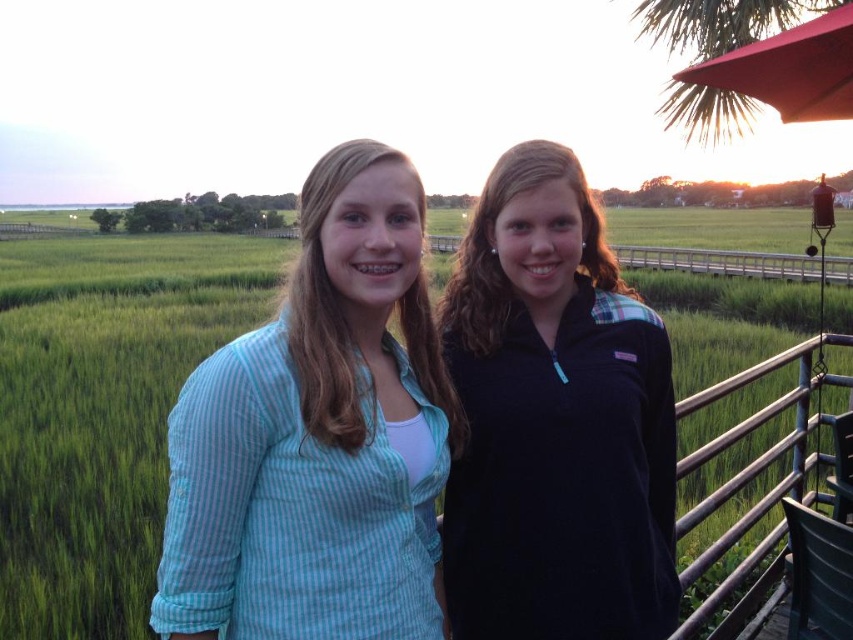
Question: Considering the real-world distances, which object is farthest from the metallic silver railing at right?

Choices:
 (A) dark blue fleece at center
 (B) light blue striped shirt at center

Answer: (B)

Question: Which is nearer to the dark blue fleece at center?

Choices:
 (A) light blue striped shirt at center
 (B) metallic silver railing at right

Answer: (A)

Question: Is dark blue fleece at center in front of metallic silver railing at right?

Choices:
 (A) yes
 (B) no

Answer: (A)

Question: Is light blue striped shirt at center behind metallic silver railing at right?

Choices:
 (A) yes
 (B) no

Answer: (B)

Question: Does dark blue fleece at center appear over metallic silver railing at right?

Choices:
 (A) no
 (B) yes

Answer: (B)

Question: Which object is farther from the camera taking this photo?

Choices:
 (A) metallic silver railing at right
 (B) light blue striped shirt at center
 (C) dark blue fleece at center

Answer: (A)